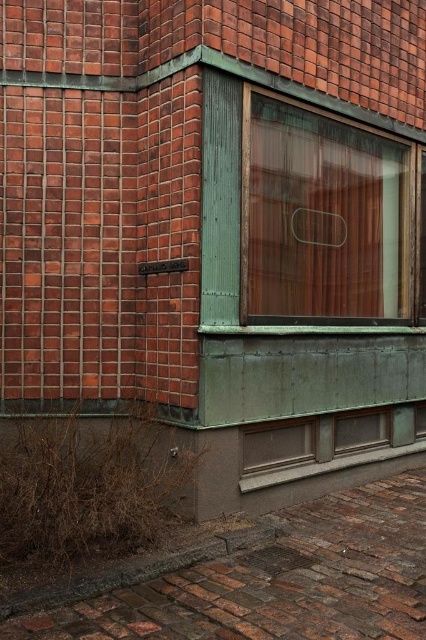
You are an architect reviewing the building facade. You need to install a new air conditioner unit that requires a minimum width of 1.2 meters. The unit must be placed either on the translucent wood window at upper center or the matte bronze window at lower center. Which window should you choose based on their widths?

The translucent wood window at upper center might be wider than matte bronze window at lower center, so it is more likely to meet the minimum width requirement of 1.2 meters for the air conditioner unit installation.

You are an architect designing a new building and want to ensure proper ventilation. You have two windows to place on a wall. The translucent wood window at upper center and the matte bronze window at lower center. Which window should you choose if you need a larger window for better airflow?

The translucent wood window at upper center has a larger size compared to the matte bronze window at lower center, so it would provide better airflow due to its larger size.